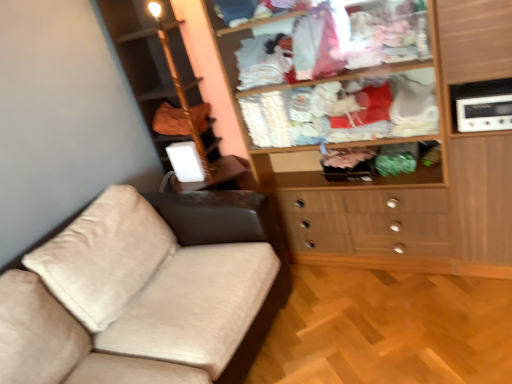
Question: Is brown fabric bag at upper left positioned in front of white plastic radio at upper right?

Choices:
 (A) yes
 (B) no

Answer: (B)

Question: Considering the relative sizes of brown fabric bag at upper left and white plastic radio at upper right in the image provided, is brown fabric bag at upper left taller than white plastic radio at upper right?

Choices:
 (A) yes
 (B) no

Answer: (A)

Question: Can you confirm if brown fabric bag at upper left is bigger than white plastic radio at upper right?

Choices:
 (A) no
 (B) yes

Answer: (B)

Question: Could you tell me if brown fabric bag at upper left is turned towards white plastic radio at upper right?

Choices:
 (A) no
 (B) yes

Answer: (A)

Question: Is brown fabric bag at upper left not close to white plastic radio at upper right?

Choices:
 (A) yes
 (B) no

Answer: (A)

Question: Do you think wooden wardrobe at upper right is within white plastic radio at upper right, or outside of it?

Choices:
 (A) outside
 (B) inside

Answer: (A)

Question: From a real-world perspective, is wooden wardrobe at upper right above or below white plastic radio at upper right?

Choices:
 (A) below
 (B) above

Answer: (A)

Question: Is point (234, 99) closer or farther from the camera than point (497, 82)?

Choices:
 (A) closer
 (B) farther

Answer: (B)

Question: From the image's perspective, relative to white plastic radio at upper right, is wooden wardrobe at upper right above or below?

Choices:
 (A) above
 (B) below

Answer: (B)

Question: Is point tap(501, 125) closer or farther from the camera than point tap(194, 105)?

Choices:
 (A) closer
 (B) farther

Answer: (A)

Question: Is white plastic radio at upper right bigger or smaller than brown fabric bag at upper left?

Choices:
 (A) small
 (B) big

Answer: (A)

Question: Choose the correct answer: Is white plastic radio at upper right inside brown fabric bag at upper left or outside it?

Choices:
 (A) outside
 (B) inside

Answer: (A)

Question: Visually, is white plastic radio at upper right positioned to the left or to the right of brown fabric bag at upper left?

Choices:
 (A) left
 (B) right

Answer: (B)

Question: Is brown fabric bag at upper left taller or shorter than white plastic radio at upper right?

Choices:
 (A) tall
 (B) short

Answer: (A)

Question: Is brown fabric bag at upper left inside or outside of white plastic radio at upper right?

Choices:
 (A) inside
 (B) outside

Answer: (B)